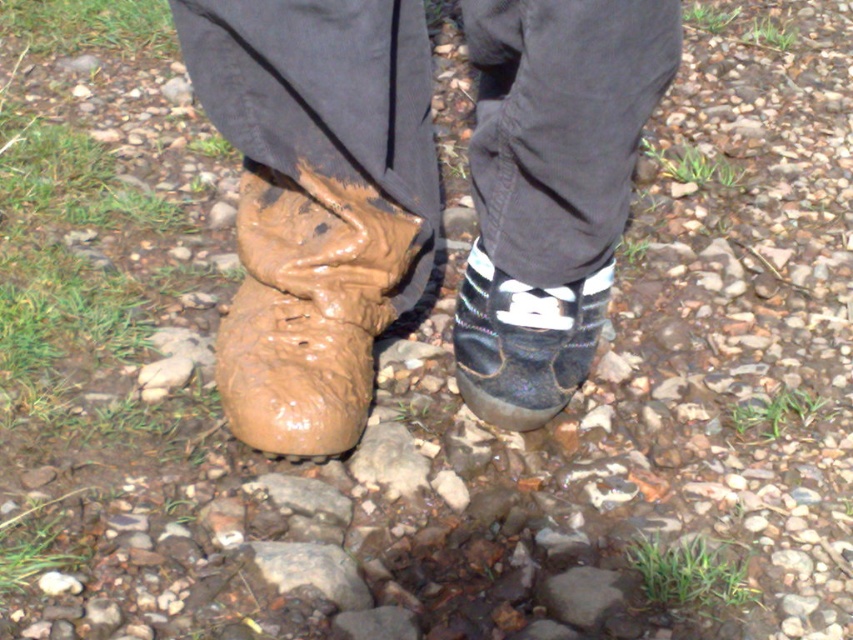
You are a delivery robot with a 15 cm wide package. You need to place the package between the muddy rubber boot at left and the shiny black shoe at lower center. Can you fit the package between them?

The muddy rubber boot at left and the shiny black shoe at lower center are 13.33 centimeters apart from each other. Since the package is 15 cm wide, it cannot fit between them as the space is narrower than the package.

You are a photographer trying to capture the shiny black shoe at lower center. To avoid the brown rough rock at center from blocking the view, should you move your camera position forward or backward?

The brown rough rock at center is behind the shiny black shoe at lower center, so moving the camera position forward would bring the shoe closer and move the rock further away, thus avoiding the blockage. Therefore, you should move forward.